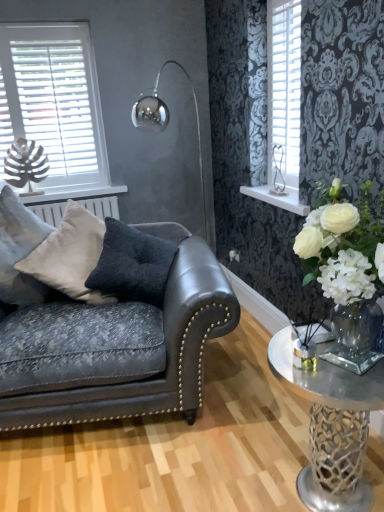
Question: From the image's perspective, is leather couch at left beneath clear glass vase at right?

Choices:
 (A) yes
 (B) no

Answer: (B)

Question: From a real-world perspective, is leather couch at left positioned over clear glass vase at right based on gravity?

Choices:
 (A) no
 (B) yes

Answer: (B)

Question: Is leather couch at left surrounding clear glass vase at right?

Choices:
 (A) yes
 (B) no

Answer: (B)

Question: Does leather couch at left appear on the left side of clear glass vase at right?

Choices:
 (A) yes
 (B) no

Answer: (A)

Question: From the image's perspective, would you say leather couch at left is positioned over clear glass vase at right?

Choices:
 (A) yes
 (B) no

Answer: (A)

Question: Based on their positions, is white plastic blinds at upper left located to the left or right of silver metallic heart-shaped ornament at upper right?

Choices:
 (A) left
 (B) right

Answer: (A)

Question: In terms of height, does white plastic blinds at upper left look taller or shorter compared to silver metallic heart-shaped ornament at upper right?

Choices:
 (A) tall
 (B) short

Answer: (A)

Question: Does point (49, 61) appear closer or farther from the camera than point (276, 195)?

Choices:
 (A) closer
 (B) farther

Answer: (B)

Question: Is white plastic blinds at upper left inside the boundaries of silver metallic heart-shaped ornament at upper right, or outside?

Choices:
 (A) outside
 (B) inside

Answer: (A)

Question: Is point (296, 385) closer or farther from the camera than point (231, 260)?

Choices:
 (A) farther
 (B) closer

Answer: (B)

Question: In terms of size, does clear glass vase at right appear bigger or smaller than white silk flower at center?

Choices:
 (A) big
 (B) small

Answer: (A)

Question: In the image, is clear glass vase at right positioned in front of or behind white silk flower at center?

Choices:
 (A) front
 (B) behind

Answer: (A)

Question: From a real-world perspective, is clear glass vase at right physically located above or below white silk flower at center?

Choices:
 (A) below
 (B) above

Answer: (A)

Question: From a real-world perspective, is leather couch at left physically located above or below white plastic shutter at upper right?

Choices:
 (A) below
 (B) above

Answer: (A)

Question: Is point (82, 311) closer or farther from the camera than point (274, 115)?

Choices:
 (A) closer
 (B) farther

Answer: (A)